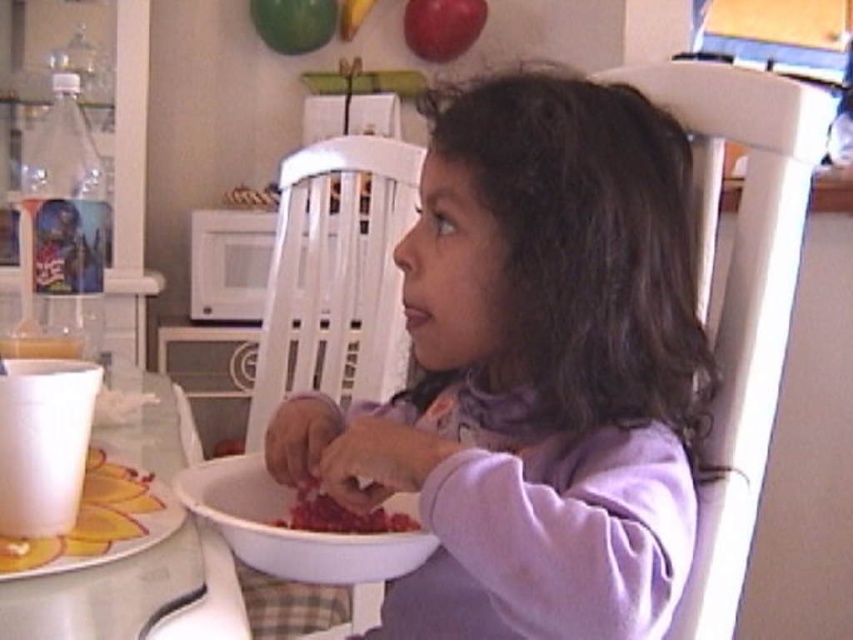
Question: Does green matte apple at upper center have a lesser width compared to translucent plastic cup at lower left?

Choices:
 (A) no
 (B) yes

Answer: (A)

Question: Which point is closer to the camera?

Choices:
 (A) translucent plastic cup at lower left
 (B) white plastic table at lower left

Answer: (B)

Question: Is white paper cup at lower left positioned at the back of translucent plastic cup at lower left?

Choices:
 (A) yes
 (B) no

Answer: (B)

Question: Among these points, which one is farthest from the camera?

Choices:
 (A) (61, 500)
 (B) (280, 49)

Answer: (B)

Question: Which object is the closest to the red matte apple at upper center?

Choices:
 (A) translucent plastic cup at lower left
 (B) green matte apple at upper center

Answer: (B)

Question: Can you confirm if purple soft shirt at center is positioned to the left of white paper cup at lower left?

Choices:
 (A) no
 (B) yes

Answer: (A)